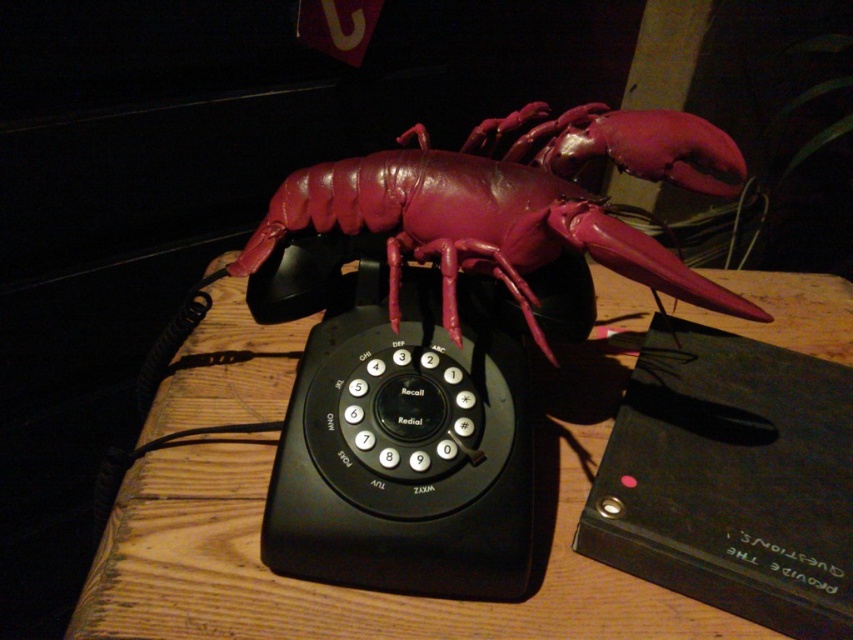
Can you confirm if wooden table at center is positioned to the left of glossy plastic lobster at center?

No, wooden table at center is not to the left of glossy plastic lobster at center.

Is wooden table at center below glossy plastic lobster at center?

Yes.

Between point (577, 572) and point (537, 260), which one is positioned behind?

Positioned behind is point (577, 572).

This screenshot has width=853, height=640. Identify the location of wooden table at center. (329, 588).

Is point (352, 611) positioned after point (314, 401)?

No, it is not.

Does wooden table at center appear on the left side of black plastic rotary phone at center?

In fact, wooden table at center is to the right of black plastic rotary phone at center.

Locate an element on the screen. Image resolution: width=853 pixels, height=640 pixels. wooden table at center is located at coordinates (329, 588).

Based on the photo, can you confirm if black plastic rotary phone at center is smaller than glossy plastic lobster at center?

Yes, black plastic rotary phone at center is smaller than glossy plastic lobster at center.

Which of these two, black plastic rotary phone at center or glossy plastic lobster at center, stands shorter?

With less height is glossy plastic lobster at center.

Measure the distance between point (340, 397) and camera.

A distance of 26.22 inches exists between point (340, 397) and camera.

Where is `black plastic rotary phone at center`? Image resolution: width=853 pixels, height=640 pixels. black plastic rotary phone at center is located at coordinates (404, 452).